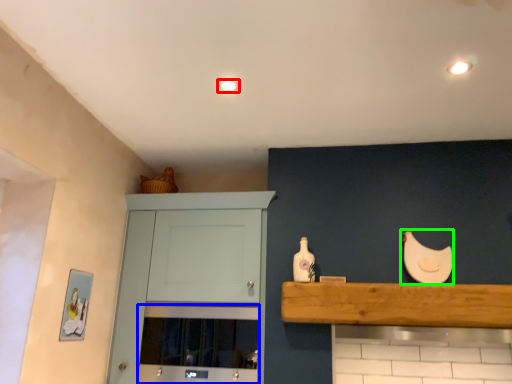
Question: Which object is the farthest from lighting (highlighted by a red box)? Choose among these: oven (highlighted by a blue box) or chicken (highlighted by a green box).

Choices:
 (A) oven
 (B) chicken

Answer: (A)